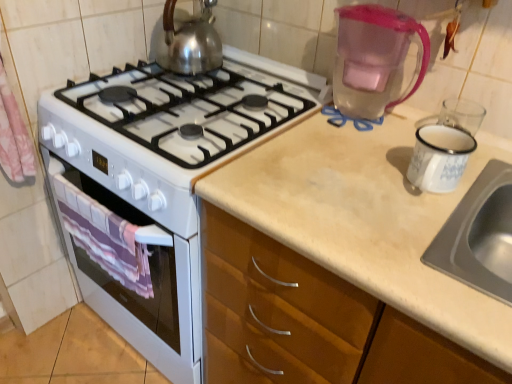
Question: Is point (408, 24) positioned closer to the camera than point (111, 220)?

Choices:
 (A) closer
 (B) farther

Answer: (B)

Question: In the image, is transparent plastic pitcher at upper right positioned in front of or behind purple striped towel at lower left?

Choices:
 (A) behind
 (B) front

Answer: (B)

Question: Estimate the real-world distances between objects in this image. Which object is farther from the purple striped towel at lower left?

Choices:
 (A) shiny metallic kettle at upper center
 (B) transparent plastic pitcher at upper right

Answer: (B)

Question: Estimate the real-world distances between objects in this image. Which object is farther from the purple striped towel at lower left?

Choices:
 (A) shiny metallic kettle at upper center
 (B) transparent plastic pitcher at upper right

Answer: (B)